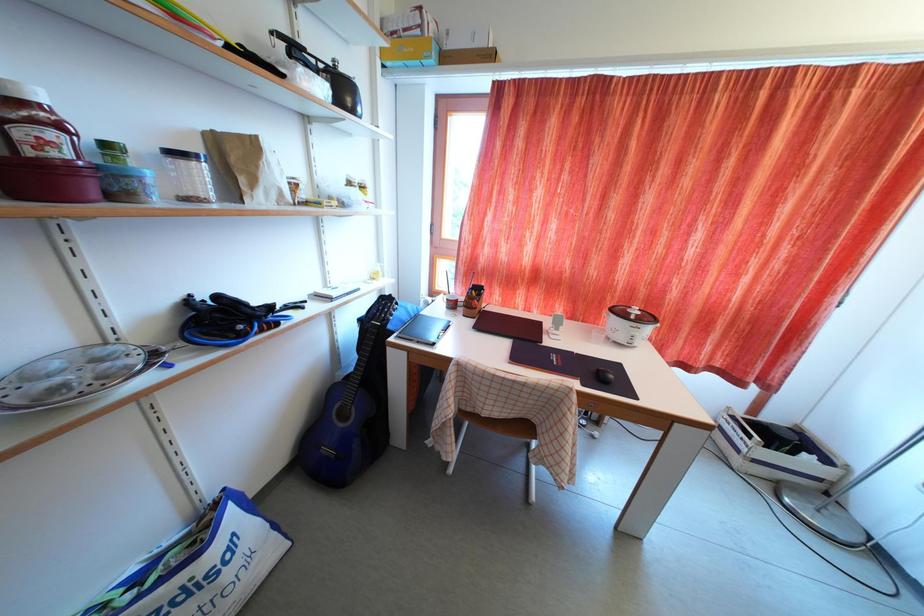
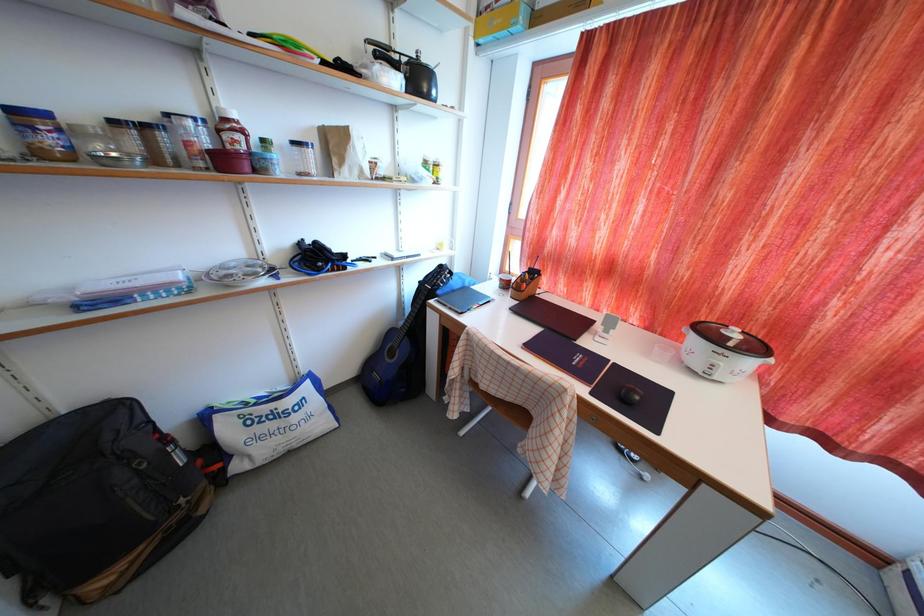
Question: The camera is either moving clockwise (left) or counter-clockwise (right) around the object. The first image is from the beginning of the video and the second image is from the end. Is the camera moving left or right when shooting the video?

Choices:
 (A) Left
 (B) Right

Answer: (B)